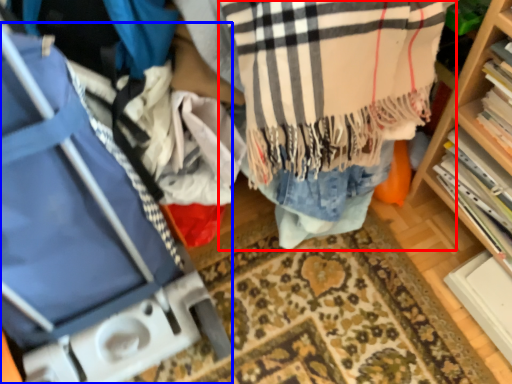
Question: Which point is further to the camera, clothing (highlighted by a red box) or luggage (highlighted by a blue box)?

Choices:
 (A) clothing
 (B) luggage

Answer: (A)